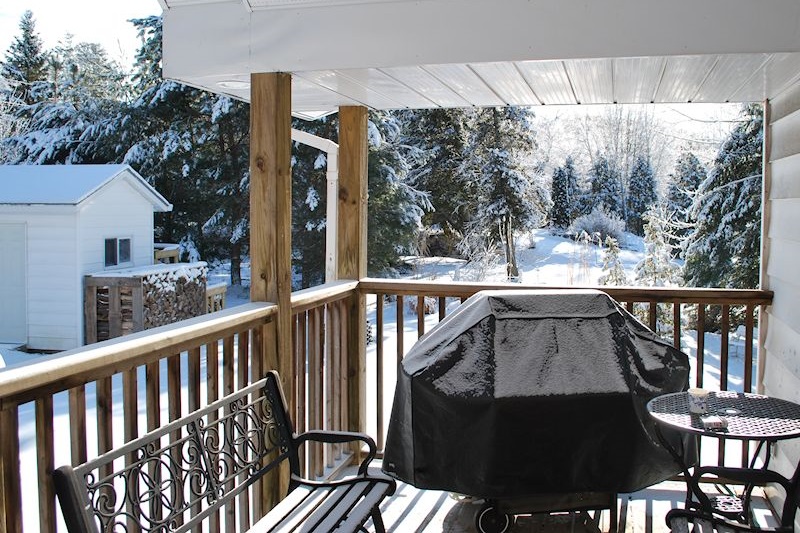
What are the coordinates of `left leg on bench` in the screenshot? It's located at (378, 520).